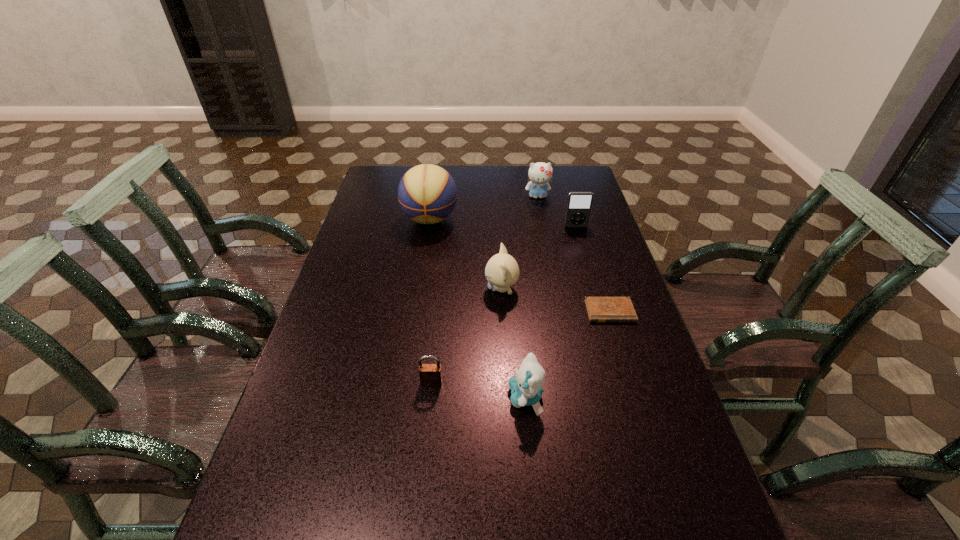
Find the location of a particular element. The height and width of the screenshot is (540, 960). object that is at the left edge is located at coordinates (427, 193).

At what (x,y) coordinates should I click in order to perform the action: click on iPod that is at the right edge. Please return your answer as a coordinate pair (x, y). The width and height of the screenshot is (960, 540). Looking at the image, I should click on (579, 204).

Identify the location of diary located in the right edge section of the desktop. (599, 309).

This screenshot has height=540, width=960. What are the coordinates of `free region at the far edge of the desktop` in the screenshot? It's located at (467, 175).

Identify the location of vacant point at the left edge. Image resolution: width=960 pixels, height=540 pixels. (304, 413).

At what (x,y) coordinates should I click in order to perform the action: click on free location at the right edge of the desktop. Please return your answer as a coordinate pair (x, y). This screenshot has width=960, height=540. Looking at the image, I should click on [604, 234].

Locate an element on the screen. The height and width of the screenshot is (540, 960). free space between the shortest object and the iPod is located at coordinates (593, 269).

Locate an element on the screen. The width and height of the screenshot is (960, 540). empty location between the diary and the padlock is located at coordinates (520, 347).

Locate an element on the screen. This screenshot has height=540, width=960. empty location between the iPod and the second shortest object is located at coordinates (504, 305).

Where is `free space between the iPod and the diary`? Image resolution: width=960 pixels, height=540 pixels. free space between the iPod and the diary is located at coordinates (593, 269).